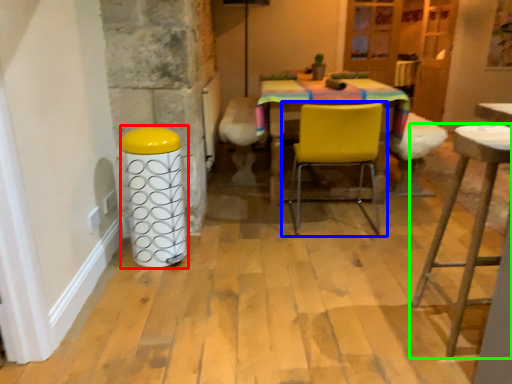
Question: Considering the real-world distances, which object is closest to bar stool (highlighted by a red box)? chair (highlighted by a blue box) or stool (highlighted by a green box).

Choices:
 (A) chair
 (B) stool

Answer: (A)